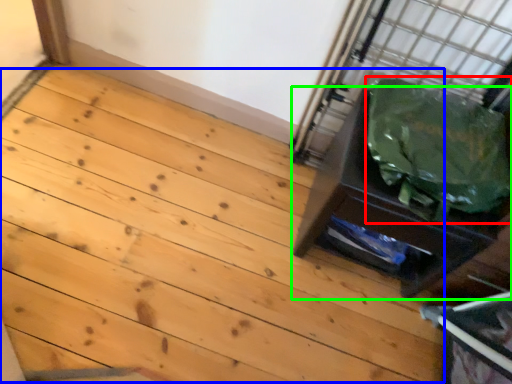
Question: Which is farther away from garbage (highlighted by a red box)? stairwell (highlighted by a blue box) or furniture (highlighted by a green box)?

Choices:
 (A) stairwell
 (B) furniture

Answer: (A)